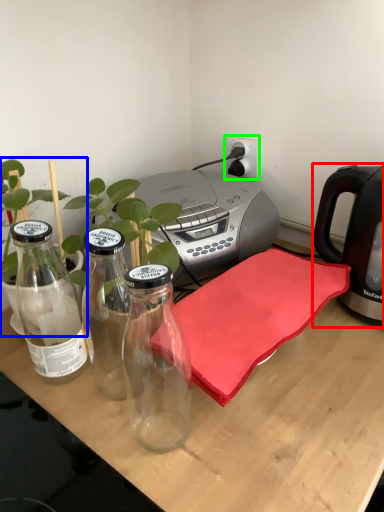
Question: Which is farther away from kettle (highlighted by a red box)? houseplant (highlighted by a blue box) or electric outlet (highlighted by a green box)?

Choices:
 (A) houseplant
 (B) electric outlet

Answer: (A)